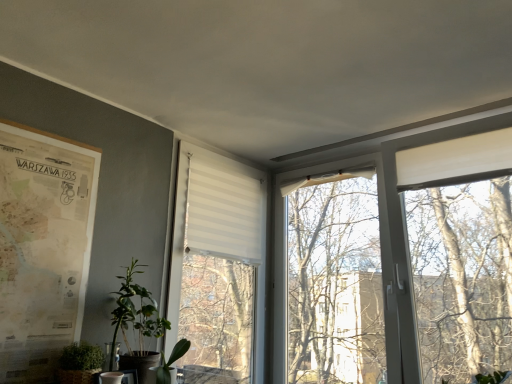
Question: Is point (60, 278) closer or farther from the camera than point (205, 152)?

Choices:
 (A) closer
 (B) farther

Answer: (A)

Question: From their relative heights in the image, would you say beige paper map at left is taller or shorter than white striped fabric at center?

Choices:
 (A) tall
 (B) short

Answer: (B)

Question: Estimate the real-world distances between objects in this image. Which object is closer to the green matte plant at lower center, acting as the 3th houseplant starting from the left?

Choices:
 (A) green matte plant at lower left, the 3th houseplant when ordered from right to left
 (B) green matte plant at lower left, placed as the second houseplant when sorted from left to right
 (C) white striped fabric at center
 (D) beige paper map at left

Answer: (B)

Question: Estimate the real-world distances between objects in this image. Which object is farther from the green matte plant at lower left, placed as the 2th houseplant when sorted from right to left?

Choices:
 (A) white striped fabric at center
 (B) beige paper map at left
 (C) green matte plant at lower center, acting as the 3th houseplant starting from the left
 (D) green matte plant at lower left, the 3th houseplant when ordered from right to left

Answer: (A)